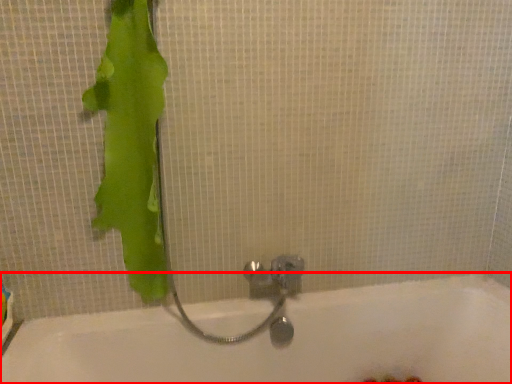
Question: Considering the relative positions of bathtub (annotated by the red box) and animal in the image provided, where is bathtub (annotated by the red box) located with respect to the staircase?

Choices:
 (A) left
 (B) right

Answer: (B)